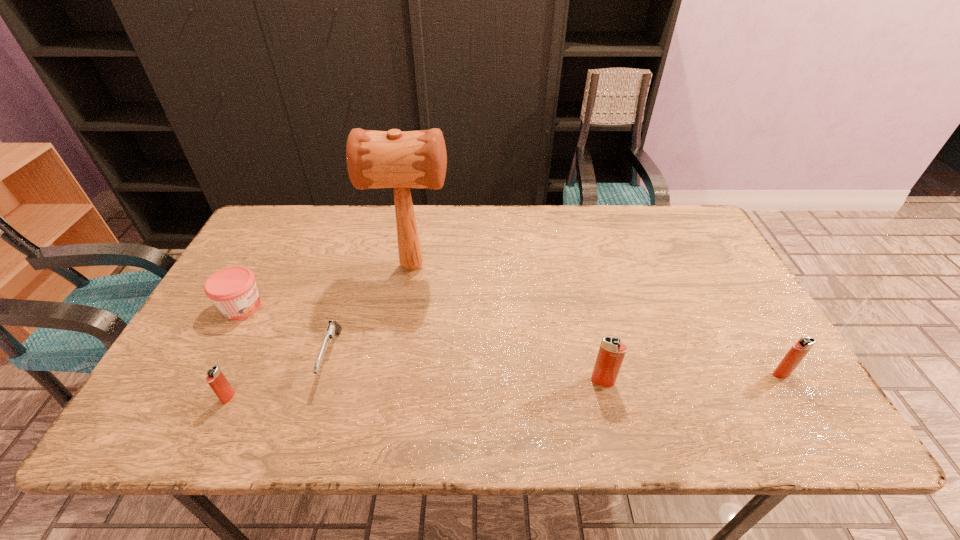
This screenshot has height=540, width=960. I want to click on free space between the fifth shortest object and the jam, so point(422,344).

Where is `free area in between the second object from right to left and the rightmost object`? This screenshot has width=960, height=540. free area in between the second object from right to left and the rightmost object is located at coordinates (692, 377).

The width and height of the screenshot is (960, 540). What are the coordinates of `free area in between the second object from left to right and the fourth object from right to left` in the screenshot? It's located at (280, 377).

Where is `free spot between the second igniter from right to left and the mallet`? free spot between the second igniter from right to left and the mallet is located at coordinates (508, 323).

Locate an element on the screen. empty space that is in between the second igniter from right to left and the mallet is located at coordinates (508, 323).

Where is `free area in between the second igniter from left to right and the leftmost object`? This screenshot has width=960, height=540. free area in between the second igniter from left to right and the leftmost object is located at coordinates click(422, 344).

You are a GUI agent. You are given a task and a screenshot of the screen. Output one action in this format:
    pyautogui.click(x=<x>, y=<y>)
    Task: Click on the free point between the pistol and the tallest igniter
    This screenshot has width=960, height=540.
    Given the screenshot: What is the action you would take?
    pyautogui.click(x=468, y=369)

At what (x,y) coordinates should I click in order to perform the action: click on free space between the fourth shortest object and the leftmost igniter. Please return your answer as a coordinate pair (x, y). Looking at the image, I should click on (505, 386).

Locate an element on the screen. This screenshot has height=540, width=960. free spot between the farthest object and the jam is located at coordinates (327, 286).

At what (x,y) coordinates should I click in order to perform the action: click on object that is the nearest to the tallest object. Please return your answer as a coordinate pair (x, y). The width and height of the screenshot is (960, 540). Looking at the image, I should click on (333, 327).